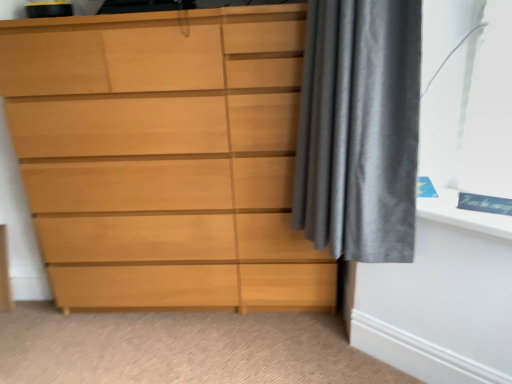
Question: Should I look upward or downward to see satin gray curtain at right?

Choices:
 (A) up
 (B) down

Answer: (A)

Question: Considering the relative positions of satin gray curtain at right and light wood chest of drawers at left in the image provided, is satin gray curtain at right behind light wood chest of drawers at left?

Choices:
 (A) yes
 (B) no

Answer: (B)

Question: Can you confirm if satin gray curtain at right is shorter than light wood chest of drawers at left?

Choices:
 (A) no
 (B) yes

Answer: (B)

Question: From the image's perspective, is satin gray curtain at right above light wood chest of drawers at left?

Choices:
 (A) no
 (B) yes

Answer: (B)

Question: Is the depth of satin gray curtain at right less than that of light wood chest of drawers at left?

Choices:
 (A) yes
 (B) no

Answer: (A)

Question: Is satin gray curtain at right surrounding light wood chest of drawers at left?

Choices:
 (A) yes
 (B) no

Answer: (B)

Question: Does satin gray curtain at right have a smaller size compared to light wood chest of drawers at left?

Choices:
 (A) yes
 (B) no

Answer: (A)

Question: Is light wood chest of drawers at left further to the viewer compared to satin gray curtain at right?

Choices:
 (A) yes
 (B) no

Answer: (A)

Question: From a real-world perspective, is light wood chest of drawers at left positioned under satin gray curtain at right based on gravity?

Choices:
 (A) yes
 (B) no

Answer: (A)

Question: Are light wood chest of drawers at left and satin gray curtain at right located far from each other?

Choices:
 (A) yes
 (B) no

Answer: (B)

Question: Is light wood chest of drawers at left taller than satin gray curtain at right?

Choices:
 (A) yes
 (B) no

Answer: (A)

Question: Does light wood chest of drawers at left have a smaller size compared to satin gray curtain at right?

Choices:
 (A) yes
 (B) no

Answer: (B)

Question: Is light wood chest of drawers at left positioned with its back to satin gray curtain at right?

Choices:
 (A) yes
 (B) no

Answer: (B)

Question: Is satin gray curtain at right taller or shorter than light wood chest of drawers at left?

Choices:
 (A) tall
 (B) short

Answer: (B)